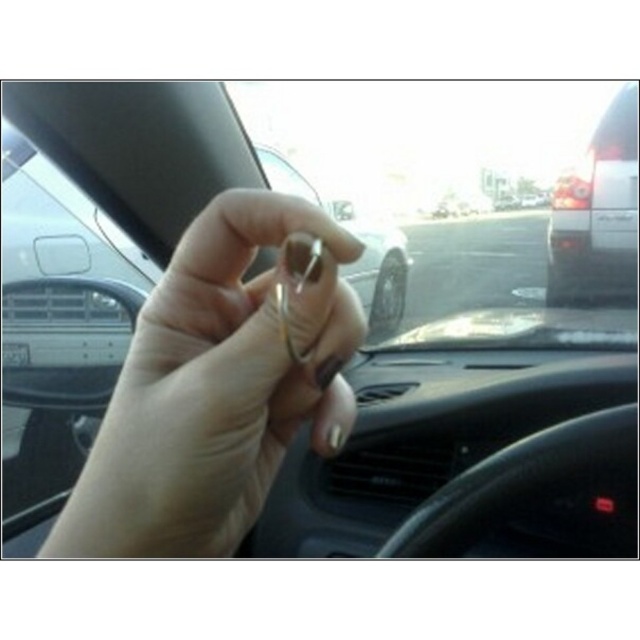
Question: Which point is closer to the camera?

Choices:
 (A) (609, 257)
 (B) (257, 147)
 (C) (16, 355)

Answer: (C)

Question: Considering the relative positions of metallic keychain at center and white matte van at right in the image provided, where is metallic keychain at center located with respect to white matte van at right?

Choices:
 (A) above
 (B) below

Answer: (A)

Question: Which object appears farthest from the camera in this image?

Choices:
 (A) metallic silver key at center
 (B) gold metallic ring at center
 (C) white matte van at right

Answer: (C)

Question: Can you confirm if metallic keychain at center is wider than gold metallic ring at center?

Choices:
 (A) no
 (B) yes

Answer: (B)

Question: Which of the following is the closest to the observer?

Choices:
 (A) metallic silver key at center
 (B) gold metallic ring at center

Answer: (B)

Question: Can you confirm if gold metallic ring at center is positioned to the left of white matte van at right?

Choices:
 (A) no
 (B) yes

Answer: (B)